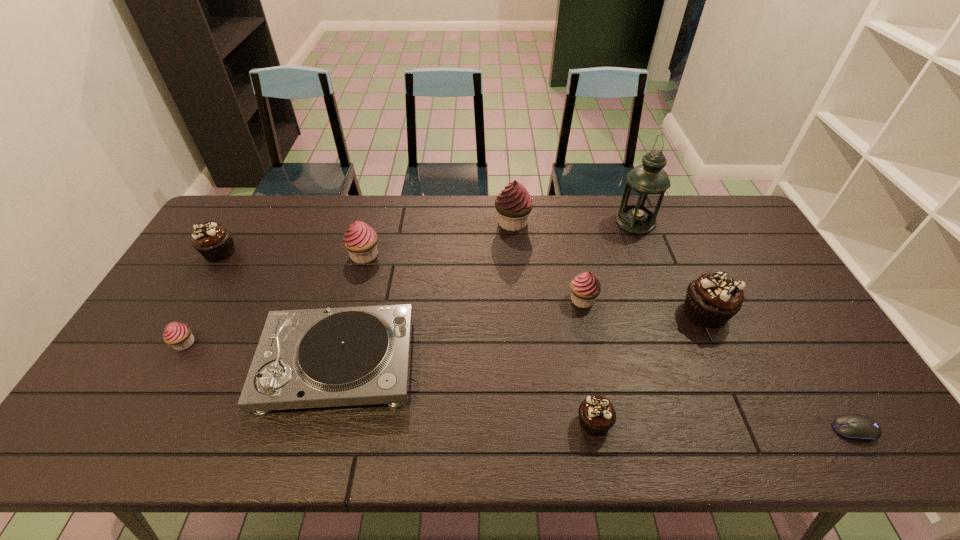
Find the location of a particular element. The height and width of the screenshot is (540, 960). vacant space located on the right of the farthest pink cupcake is located at coordinates (582, 222).

This screenshot has width=960, height=540. In order to click on vacant space situated 0.110m on the left of the rightmost brown cupcake in this screenshot , I will do `click(642, 313)`.

This screenshot has height=540, width=960. What are the coordinates of `vacant space located 0.320m on the left of the third cupcake from left to right` in the screenshot? It's located at (250, 255).

Identify the location of vacant area located 0.320m on the right of the leftmost brown cupcake. The width and height of the screenshot is (960, 540). (334, 253).

The image size is (960, 540). What are the coordinates of `vacant space located 0.200m on the back of the second nearest pink cupcake` in the screenshot? It's located at (570, 245).

The width and height of the screenshot is (960, 540). I want to click on blank space located on the left of the record player, so click(x=189, y=363).

Image resolution: width=960 pixels, height=540 pixels. Find the location of `vacant area situated on the right of the leftmost pink cupcake`. vacant area situated on the right of the leftmost pink cupcake is located at coordinates (222, 343).

At what (x,y) coordinates should I click in order to perform the action: click on free space located 0.250m on the left of the second brown cupcake from right to left. Please return your answer as a coordinate pair (x, y). The height and width of the screenshot is (540, 960). Looking at the image, I should click on (470, 422).

Locate an element on the screen. Image resolution: width=960 pixels, height=540 pixels. blank space located on the left of the shortest object is located at coordinates (722, 430).

Identify the location of oil lamp located in the far edge section of the desktop. This screenshot has height=540, width=960. (646, 184).